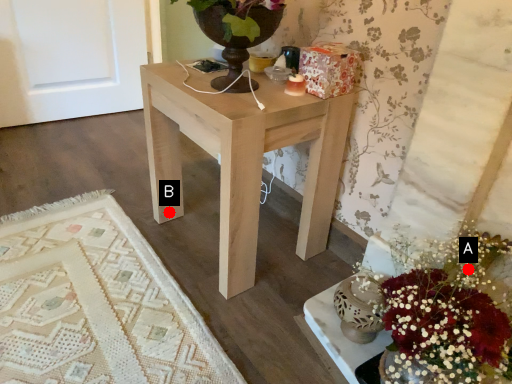
Question: Two points are circled on the image, labeled by A and B beside each circle. Which of the following is the closest to the observer?

Choices:
 (A) A is closer
 (B) B is closer

Answer: (A)